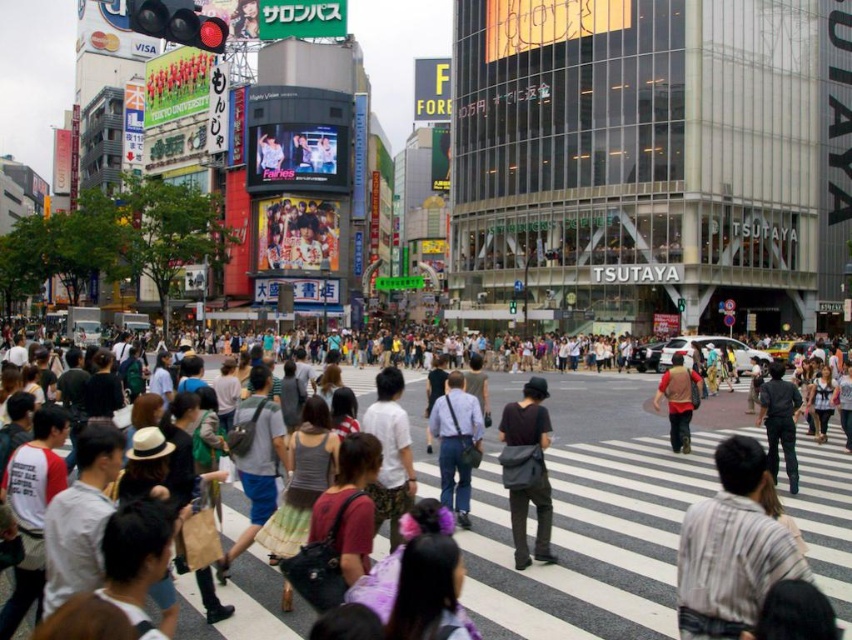
You are a pedestrian standing at the intersection and want to cross the street. You notice the white striped crosswalk at center and the matte gray tank top at center. Which object is closer to you?

The white striped crosswalk at center is positioned under the matte gray tank top at center, meaning the matte gray tank top at center is closer to you.

You are standing at the intersection and want to cross the street safely. The white striped crosswalk at center is marked at coordinates point 0.798, 0.700. If you are currently at point 0.5, 0.5, which direction should you walk to reach the crosswalk?

To reach the white striped crosswalk at center located at point (596, 509) from your current position at (426, 320), you should walk northeast. This is because the crosswalk is both to the right and above your current coordinates, requiring a diagonal movement towards the northeast direction.